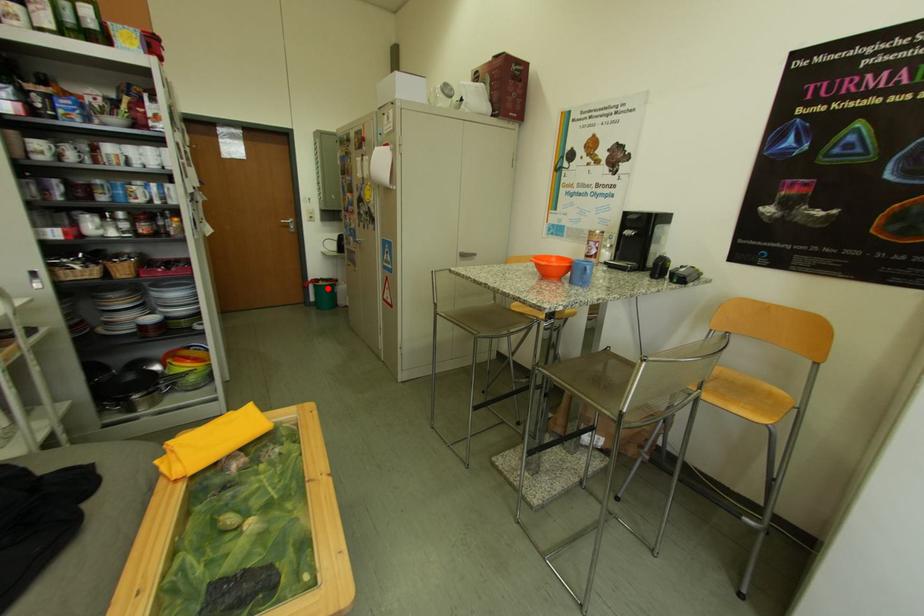
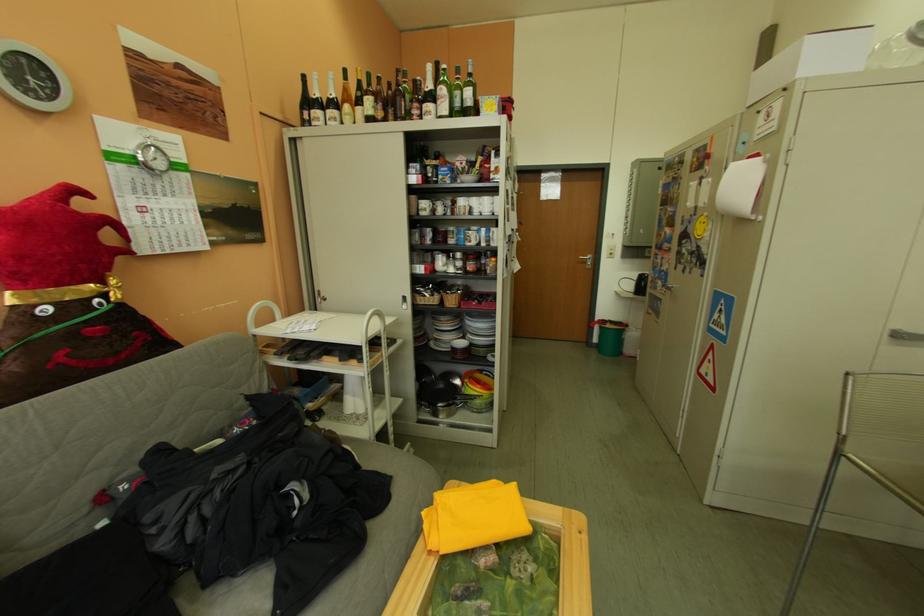
Question: I am providing you with two images of the same scene from different viewpoints. A red point is shown in image1. For the corresponding object point in image2, is it positioned nearer or farther from the camera?

Choices:
 (A) Nearer
 (B) Farther

Answer: (A)